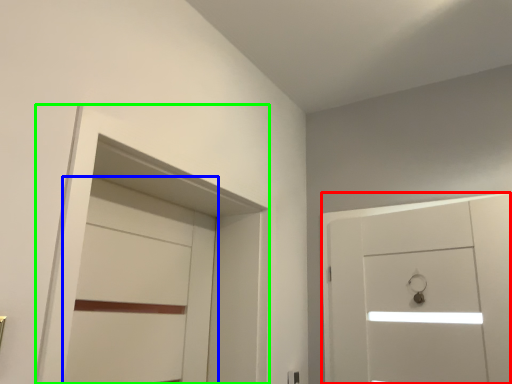
Question: Which is farther away from door (highlighted by a red box)? door (highlighted by a blue box) or locker (highlighted by a green box)?

Choices:
 (A) door
 (B) locker

Answer: (A)